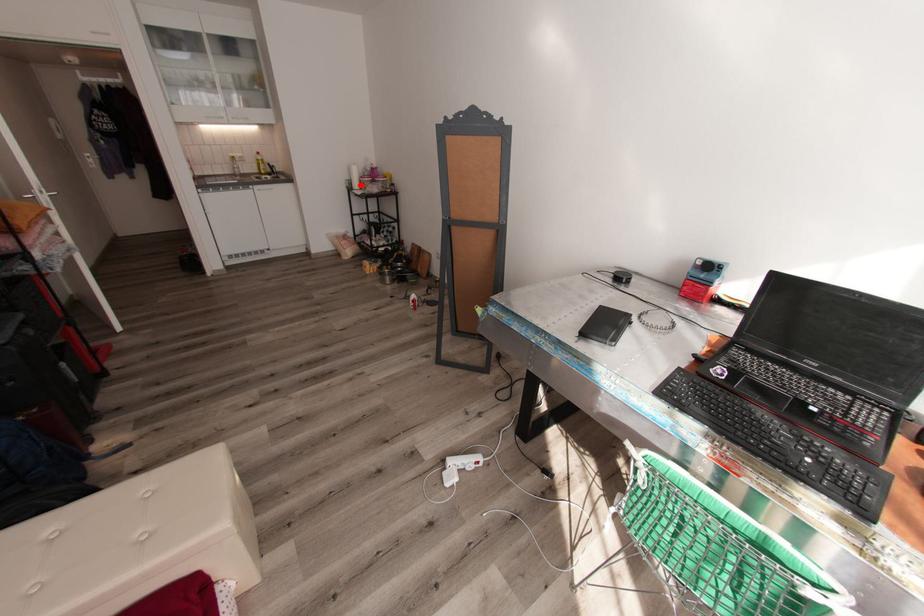
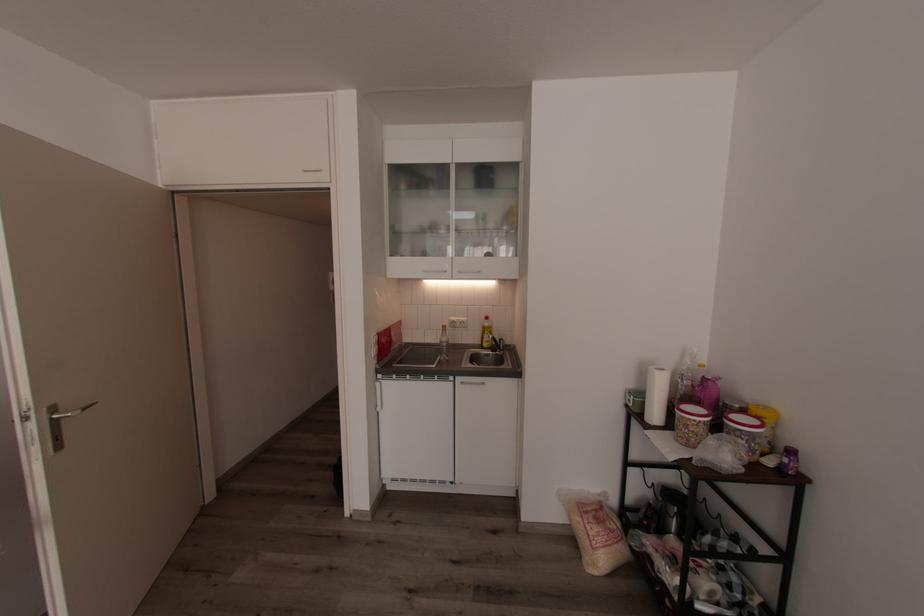
In the second image, find the point that corresponds to the highlighted location in the first image.

(660, 415)